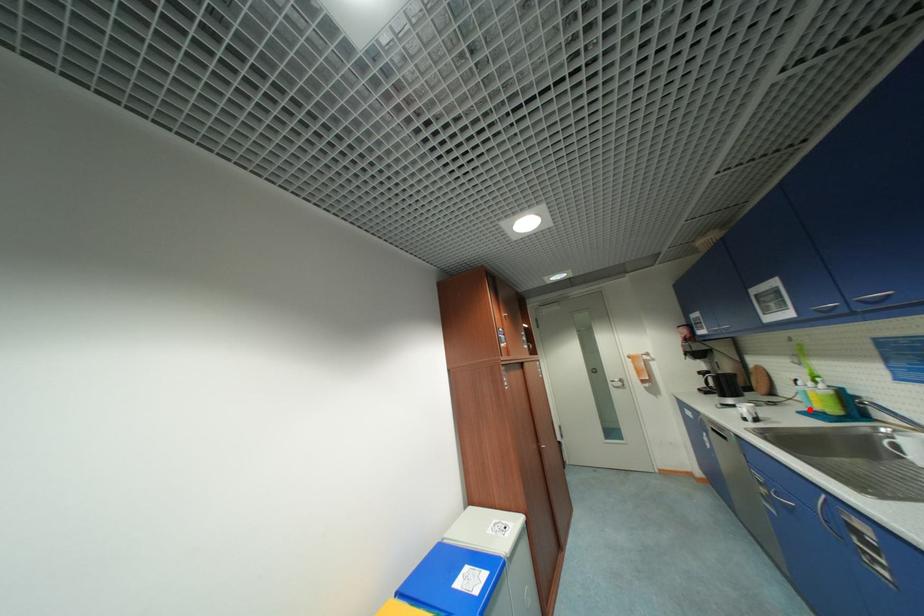
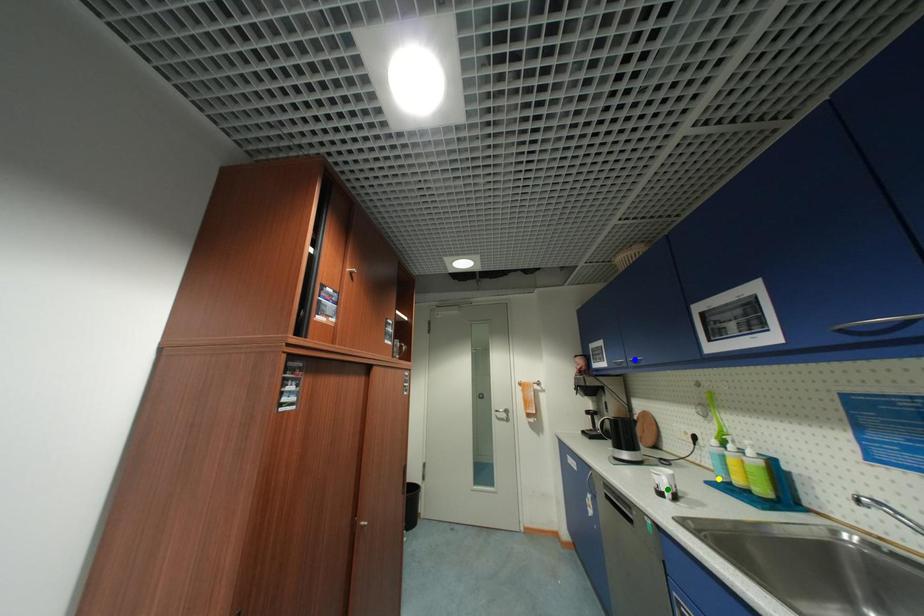
Question: I am providing you with two images of the same scene from different viewpoints. A red point is marked on the first image. You are given multiple points on the second image. Which point in image 2 represents the same 3d spot as the red point in image 1?

Choices:
 (A) blue point
 (B) yellow point
 (C) green point

Answer: (B)